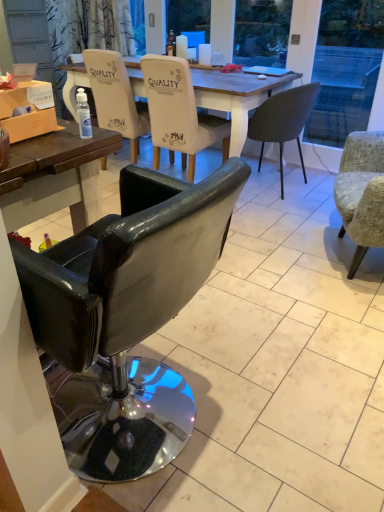
This screenshot has height=512, width=384. Find the location of `vacant space in black leather chair at lower left, acting as the 1th chair starting from the front (from a real-world perspective)`. vacant space in black leather chair at lower left, acting as the 1th chair starting from the front (from a real-world perspective) is located at coordinates (133, 412).